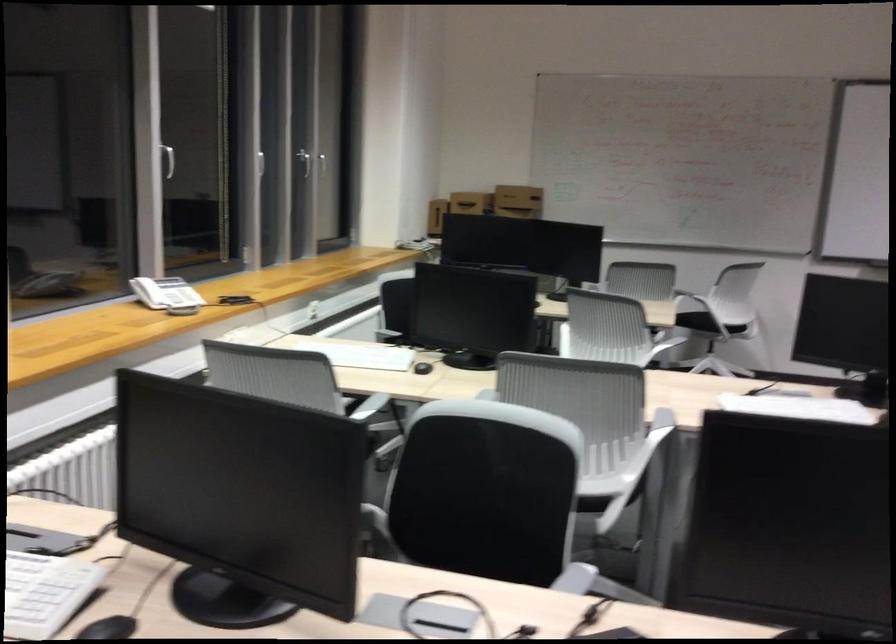
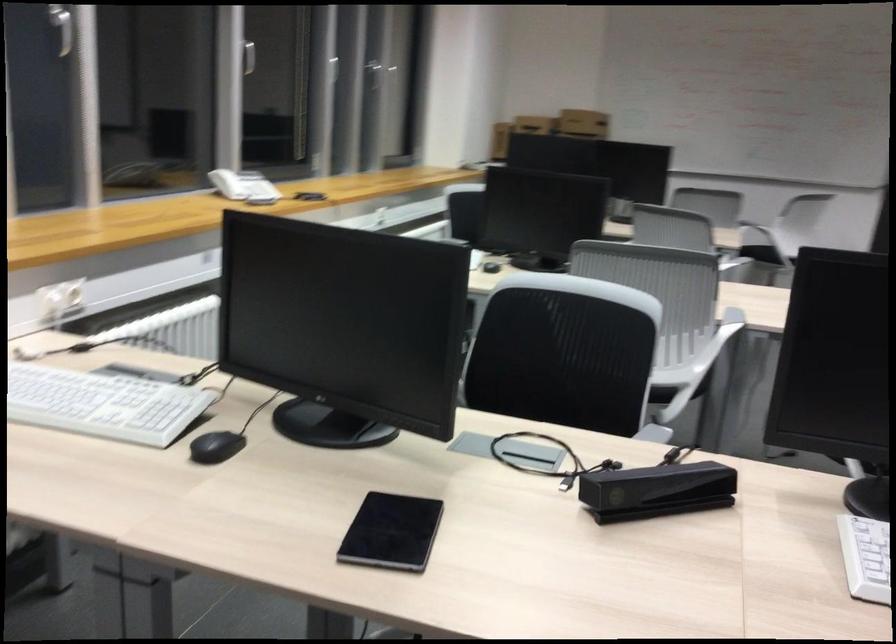
Where in the second image is the point corresponding to point (487, 483) from the first image?

(564, 353)